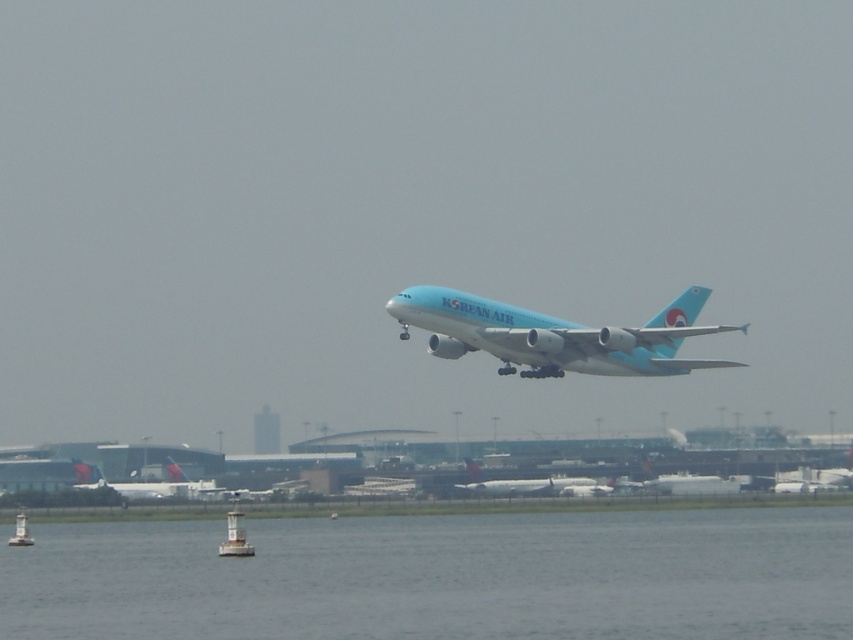
Is light blue glossy airplane at center below light blue metallic airplane at center?

Actually, light blue glossy airplane at center is above light blue metallic airplane at center.

Which is behind, point (531, 364) or point (585, 484)?

Point (585, 484)

Which is behind, point (634, 342) or point (576, 480)?

Positioned behind is point (576, 480).

Find the location of a particular element. The image size is (853, 640). light blue glossy airplane at center is located at coordinates (554, 336).

Which is more to the left, transparent water at lower center or light blue metallic airplane at center?

transparent water at lower center

Is transparent water at lower center smaller than light blue metallic airplane at center?

Incorrect, transparent water at lower center is not smaller in size than light blue metallic airplane at center.

Is point (113, 566) farther from camera compared to point (607, 486)?

No.

What are the coordinates of `transparent water at lower center` in the screenshot? It's located at (440, 577).

Who is positioned more to the right, light blue metallic airplane at center or white plastic buoy at lower center?

Positioned to the right is light blue metallic airplane at center.

In the scene shown: Does light blue metallic airplane at center have a greater height compared to white plastic buoy at lower center?

No.

The height and width of the screenshot is (640, 853). What do you see at coordinates (527, 484) in the screenshot?
I see `light blue metallic airplane at center` at bounding box center [527, 484].

This screenshot has height=640, width=853. I want to click on light blue metallic airplane at center, so click(527, 484).